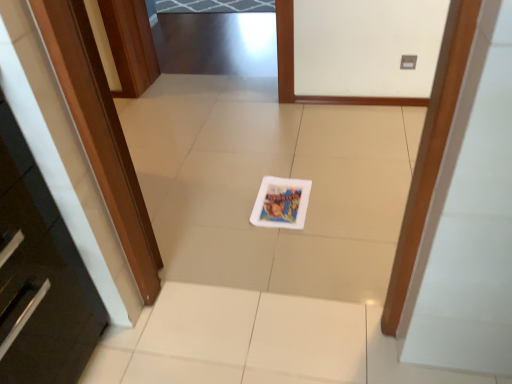
Find the location of a particular element. free space to the back side of wooden door at left is located at coordinates pos(177,159).